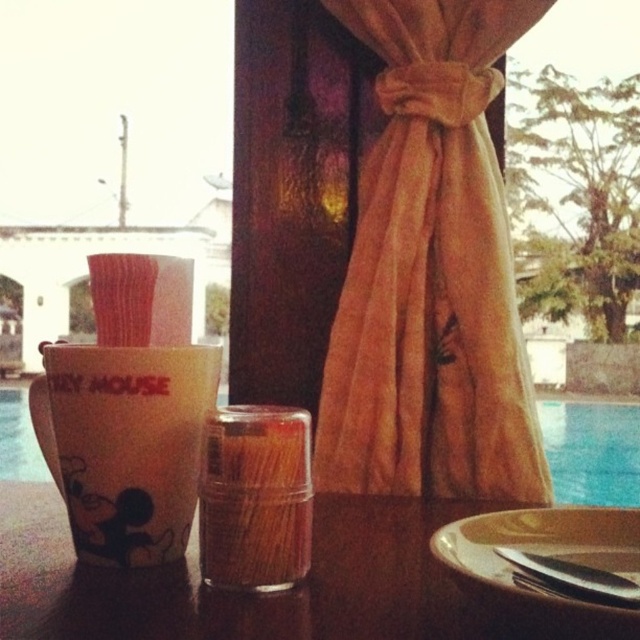
You are a guest at this outdoor dining area and want to place a napkin on the table. To ensure it stays in place, where should you place it relative to the white glossy cup at left and the wooden table at center?

The wooden table at center is in front of the white glossy cup at left, so placing the napkin on the wooden table at center closer to the front side away from the cup would help it stay in place.

You are setting up a picnic and need to place a blanket on the ground. You see the wooden table at center and the translucent plastic toothpicks at center. Which object is closer to the ground?

The wooden table at center is closer to the ground because it is below the translucent plastic toothpicks at center.

You are setting up a centerpiece for a party and need to place a decorative item between the velvet gold curtain at center and the blue glass at upper right. Based on their positions, where should you place the item to ensure it is between them?

The velvet gold curtain at center is to the left of blue glass at upper right, so placing the decorative item between them would require positioning it to the right of the velvet gold curtain at center and to the left of the blue glass at upper right.